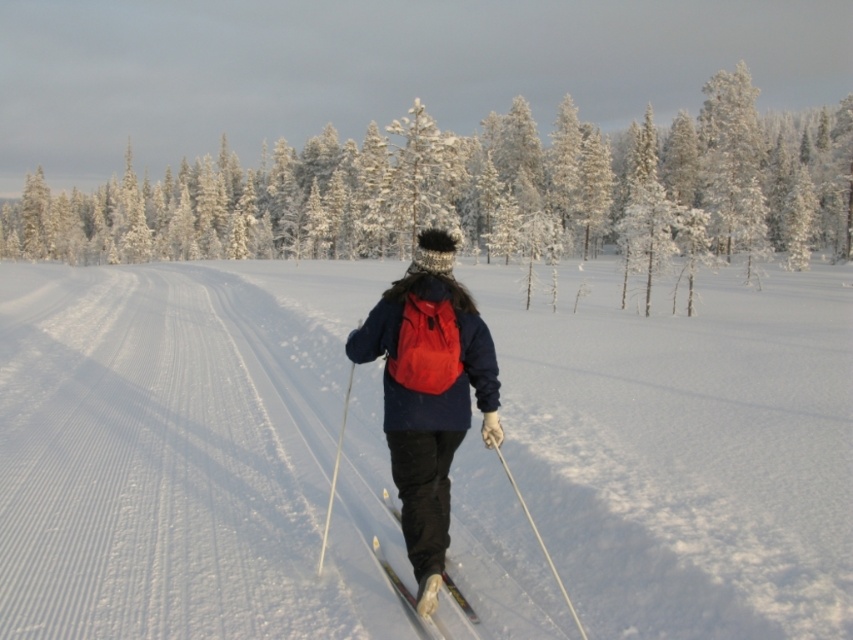
You are a drone operator trying to capture the skier in the center. You have a camera with a zoom lens. The camera can only focus on objects within a 0.1 unit radius around the point specified by the coordinate. The point given is point (471, 189). Will the camera focus on the skier in the center?

The point (471, 189) is on white snow covered tree at center, so the camera will focus on the white snow covered tree at center instead of the skier in the center.

You are a photographer trying to capture a closeup shot of the matte blue jacket at center and the white plastic ski pole at lower center. Based on their sizes in the image, which object should you focus on first if you want to ensure both are in focus?

The matte blue jacket at center is taller than the white plastic ski pole at lower center, so focusing on the taller object first would ensure both are in focus.

You are a photographer planning to capture the winter scene. You want to place a tripod at the point marked as point (450, 179) to take a photo of the cross country skier. Given that your camera has a maximum focus range of 70 meters, will the tripod be within the focus range?

The point (450, 179) is 73.03 meters away from the camera, which exceeds the camera maximum focus range of 70 meters. Therefore, the tripod will not be within the focus range.